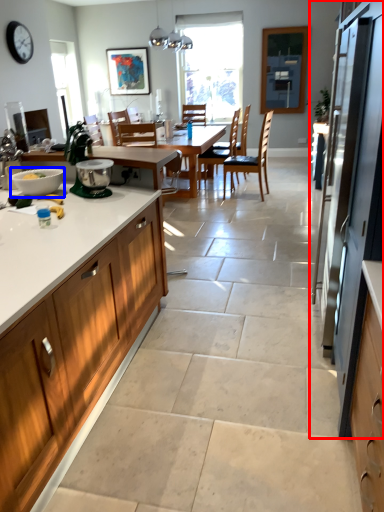
Question: Among these objects, which one is farthest to the camera, fridge (highlighted by a red box) or bowl (highlighted by a blue box)?

Choices:
 (A) fridge
 (B) bowl

Answer: (B)